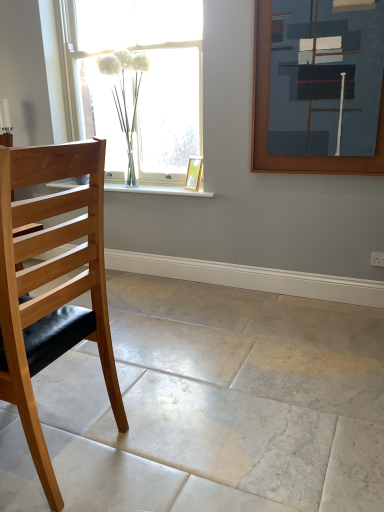
You are a GUI agent. You are given a task and a screenshot of the screen. Output one action in this format:
    pyautogui.click(x=<x>, y=<y>)
    Task: Click on the empty space that is ontop of white marble floor at lower left (from a real-world perspective)
    This screenshot has width=384, height=512.
    Given the screenshot: What is the action you would take?
    (x=205, y=366)